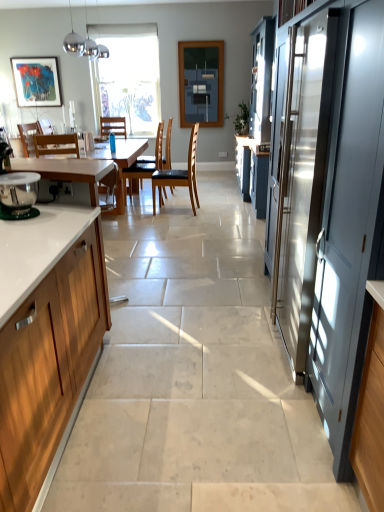
Question: Is black leather chair at center, the fourth chair viewed from the left, looking in the opposite direction of wooden chair at center, marked as the 2th chair in a right-to-left arrangement?

Choices:
 (A) no
 (B) yes

Answer: (A)

Question: Does black leather chair at center, placed as the first chair when sorted from right to left, have a smaller size compared to wooden chair at center, the 3th chair when ordered from left to right?

Choices:
 (A) no
 (B) yes

Answer: (B)

Question: Is black leather chair at center, placed as the first chair when sorted from right to left, further to the viewer compared to wooden chair at center, marked as the 2th chair in a right-to-left arrangement?

Choices:
 (A) yes
 (B) no

Answer: (B)

Question: Can you confirm if black leather chair at center, the fourth chair viewed from the left, is positioned to the left of wooden chair at center, marked as the 2th chair in a right-to-left arrangement?

Choices:
 (A) no
 (B) yes

Answer: (A)

Question: Is black leather chair at center, the fourth chair viewed from the left, positioned before wooden chair at center, the 3th chair when ordered from left to right?

Choices:
 (A) no
 (B) yes

Answer: (B)

Question: Are black leather chair at center, placed as the first chair when sorted from right to left, and wooden chair at center, the 3th chair when ordered from left to right, located far from each other?

Choices:
 (A) no
 (B) yes

Answer: (A)

Question: From the image's perspective, is matte glass window screen at center on top of wooden chair at center, marked as the 2th chair in a right-to-left arrangement?

Choices:
 (A) yes
 (B) no

Answer: (A)

Question: Does matte glass window screen at center have a greater width compared to wooden chair at center, marked as the 2th chair in a right-to-left arrangement?

Choices:
 (A) no
 (B) yes

Answer: (A)

Question: Are matte glass window screen at center and wooden chair at center, the 3th chair when ordered from left to right, far apart?

Choices:
 (A) no
 (B) yes

Answer: (B)

Question: Considering the relative sizes of matte glass window screen at center and wooden chair at center, marked as the 2th chair in a right-to-left arrangement, in the image provided, is matte glass window screen at center smaller than wooden chair at center, marked as the 2th chair in a right-to-left arrangement,?

Choices:
 (A) yes
 (B) no

Answer: (A)

Question: Considering the relative sizes of matte glass window screen at center and wooden chair at center, the 3th chair when ordered from left to right, in the image provided, is matte glass window screen at center thinner than wooden chair at center, the 3th chair when ordered from left to right,?

Choices:
 (A) no
 (B) yes

Answer: (B)

Question: Is matte glass window screen at center placed right next to wooden chair at center, marked as the 2th chair in a right-to-left arrangement?

Choices:
 (A) no
 (B) yes

Answer: (A)

Question: Considering the relative sizes of white wood cabinet at left and matte gray screen door at right in the image provided, is white wood cabinet at left bigger than matte gray screen door at right?

Choices:
 (A) yes
 (B) no

Answer: (B)